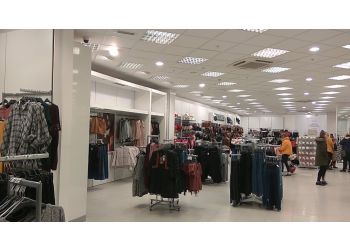
This screenshot has width=350, height=250. What are the coordinates of `empty shelves` in the screenshot? It's located at (x=108, y=101), (x=155, y=107).